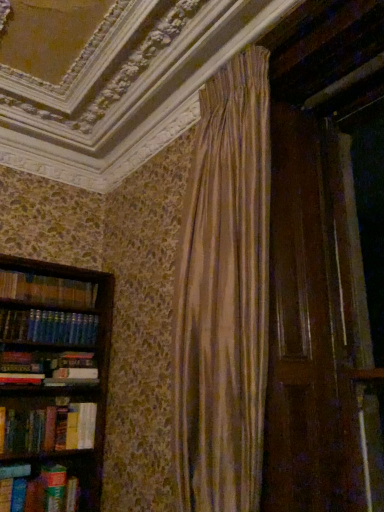
Question: From the image's perspective, is hardcover book at left positioned above or below green matte paperback book at lower left?

Choices:
 (A) below
 (B) above

Answer: (B)

Question: Is hardcover book at left in front of or behind green matte paperback book at lower left in the image?

Choices:
 (A) front
 (B) behind

Answer: (A)

Question: From their relative heights in the image, would you say hardcover book at left is taller or shorter than green matte paperback book at lower left?

Choices:
 (A) short
 (B) tall

Answer: (A)

Question: Considering the positions of point (56, 508) and point (56, 467), is point (56, 508) closer or farther from the camera than point (56, 467)?

Choices:
 (A) closer
 (B) farther

Answer: (A)

Question: From a real-world perspective, relative to hardcover book at left, is green matte paperback book at lower left vertically above or below?

Choices:
 (A) above
 (B) below

Answer: (A)

Question: In terms of height, does green matte paperback book at lower left look taller or shorter compared to hardcover book at left?

Choices:
 (A) tall
 (B) short

Answer: (A)

Question: Is green matte paperback book at lower left wider or thinner than hardcover book at left?

Choices:
 (A) wide
 (B) thin

Answer: (A)